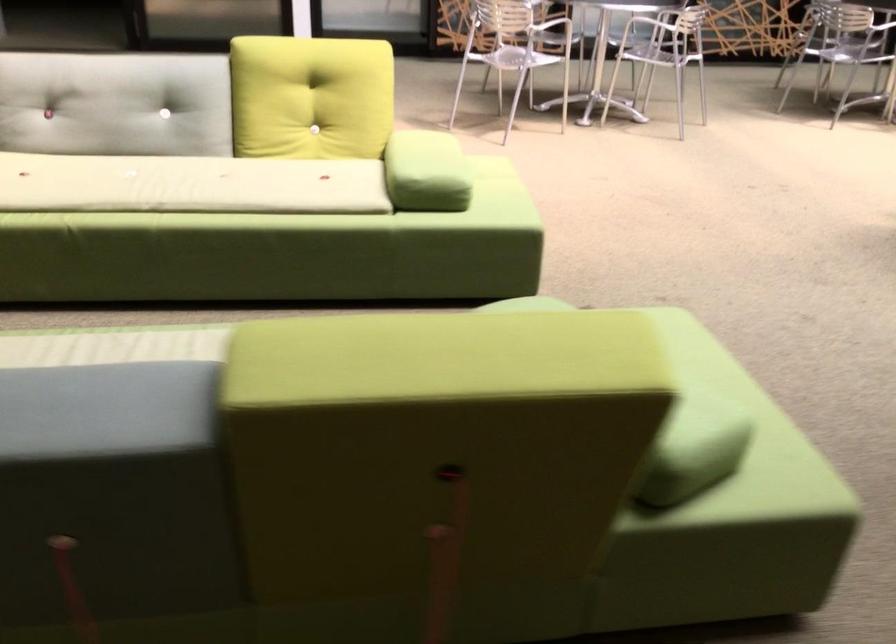
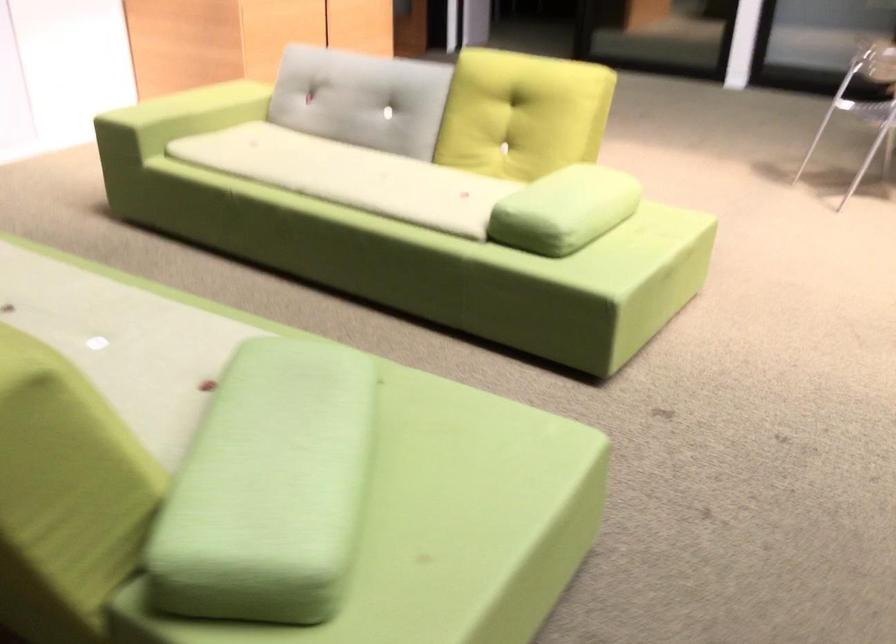
The point at (196,182) is marked in the first image. Where is the corresponding point in the second image?

(349, 176)